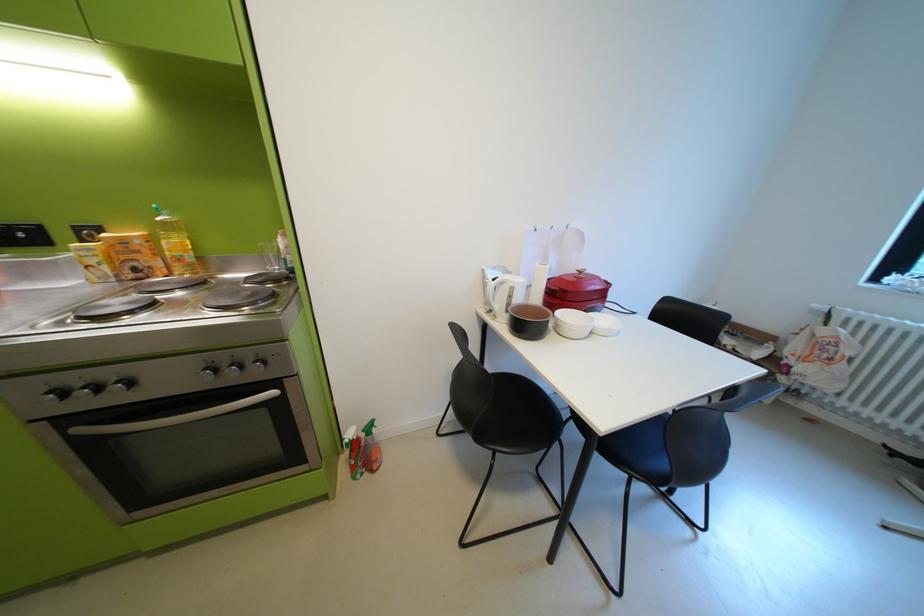
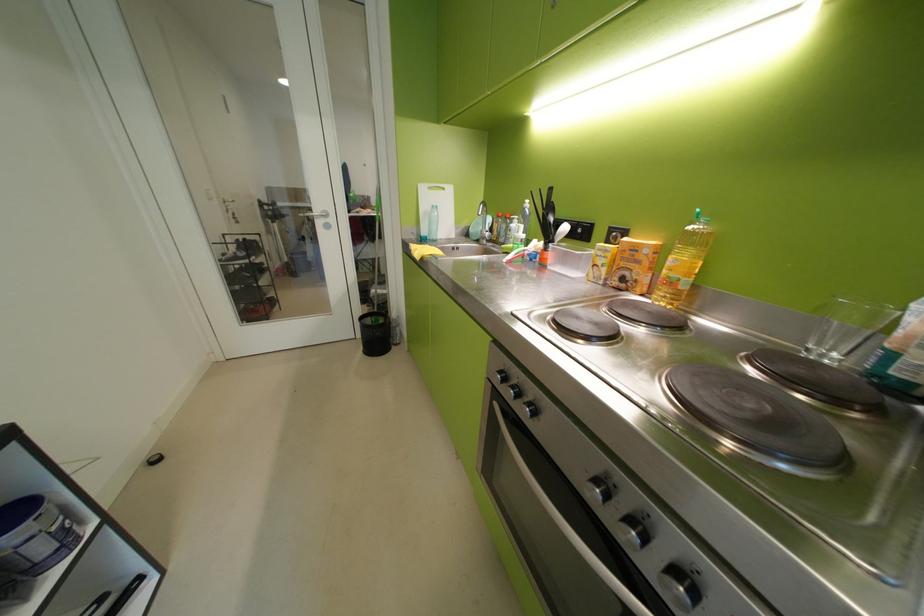
Where in the second image is the point corresponding to pixel 83 456 from the first image?

(497, 416)